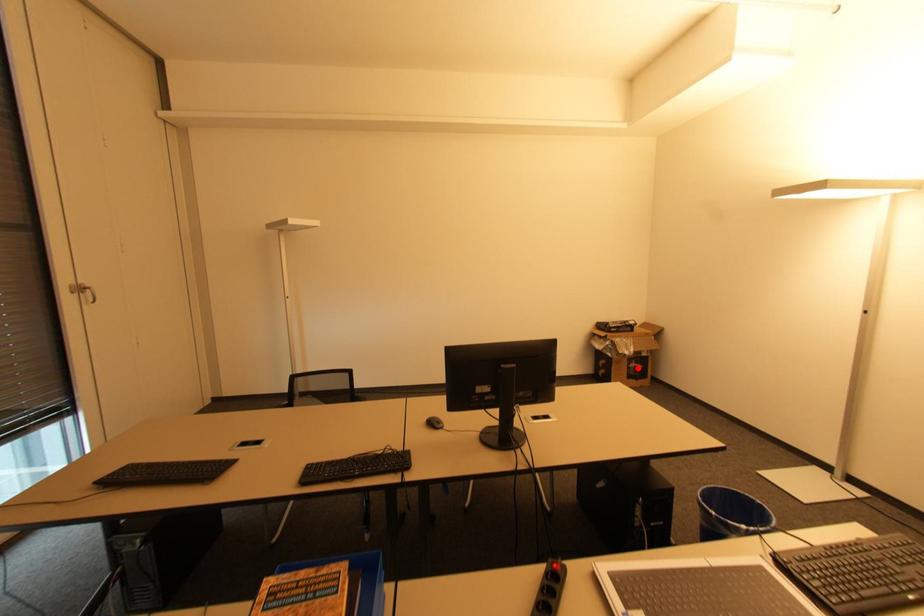
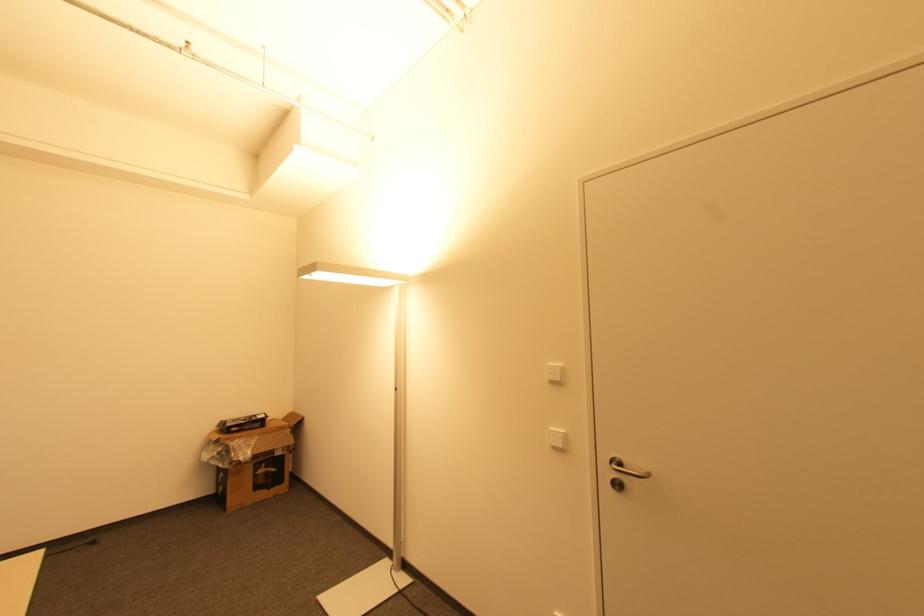
The point at the highlighted location is marked in the first image. Where is the corresponding point in the second image?

(268, 472)